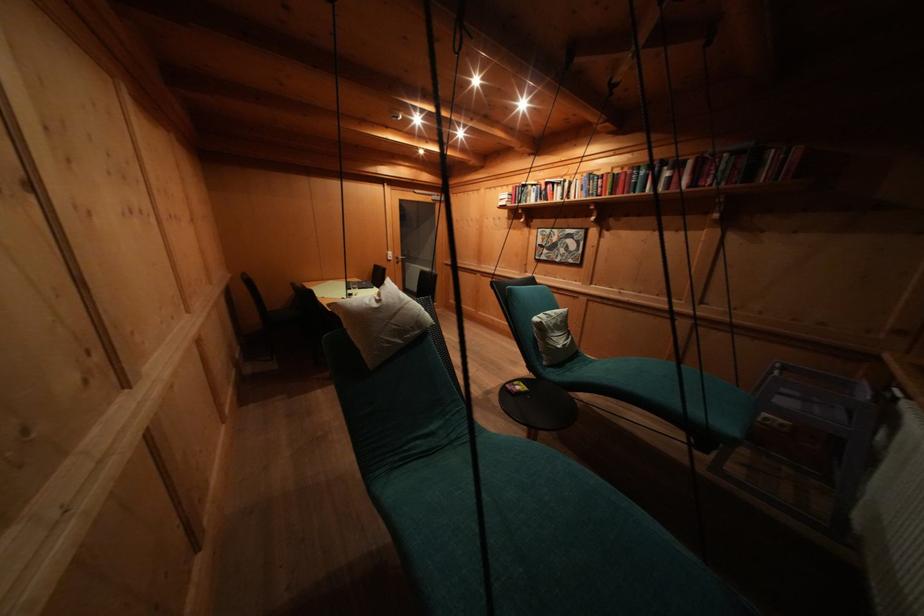
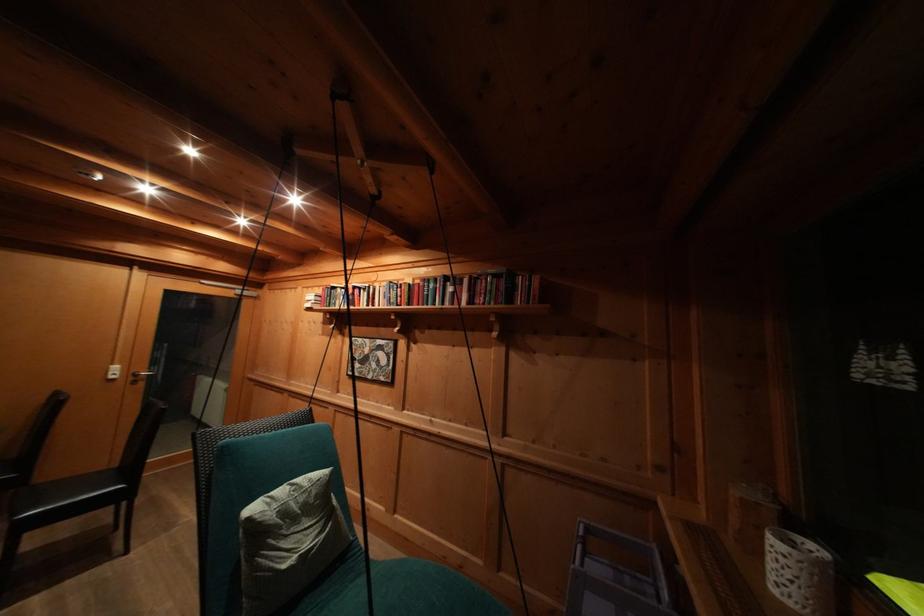
Locate, in the second image, the point that corresponds to (404,262) in the first image.

(141, 379)